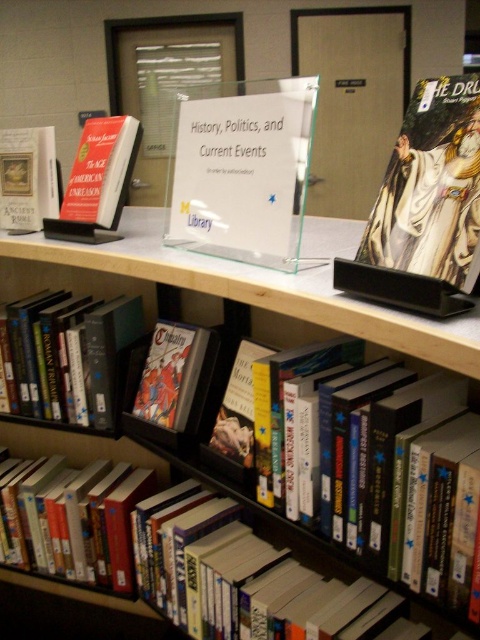
Question: Based on their relative distances, which object is nearer to the clear acrylic sign at center?

Choices:
 (A) hardcover books at center
 (B) hardcover book at left
 (C) hardcover book at center

Answer: (A)

Question: Estimate the real-world distances between objects in this image. Which object is farther from the hardcover books at center?

Choices:
 (A) matte plastic comic book at center
 (B) hardcover comic book at upper right
 (C) hardcover book at center

Answer: (B)

Question: Does hardcover book at center appear under hardcover book at left?

Choices:
 (A) yes
 (B) no

Answer: (A)

Question: Can you confirm if matte plastic comic book at center is positioned below hardcover book at left?

Choices:
 (A) no
 (B) yes

Answer: (B)

Question: Which object appears farthest from the camera in this image?

Choices:
 (A) clear acrylic sign at center
 (B) hardcover comic book at upper right

Answer: (A)

Question: From the image, what is the correct spatial relationship of clear acrylic sign at center in relation to hardcover comic book at upper right?

Choices:
 (A) above
 (B) below

Answer: (A)